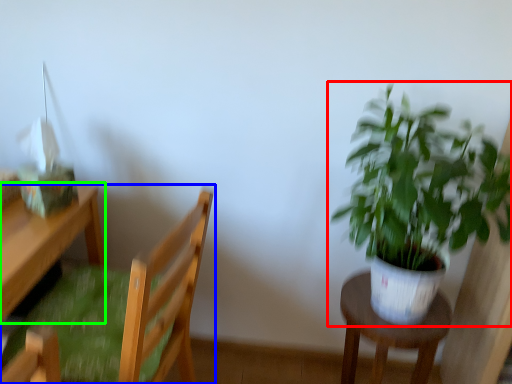
Question: Considering the real-world distances, which object is closest to houseplant (highlighted by a red box)? chair (highlighted by a blue box) or desk (highlighted by a green box).

Choices:
 (A) chair
 (B) desk

Answer: (A)